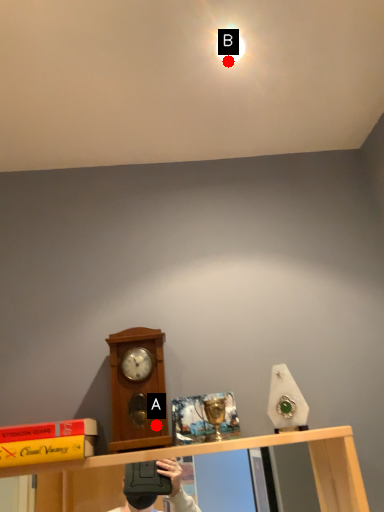
Question: Two points are circled on the image, labeled by A and B beside each circle. Which point appears closest to the camera in this image?

Choices:
 (A) A is closer
 (B) B is closer

Answer: (A)